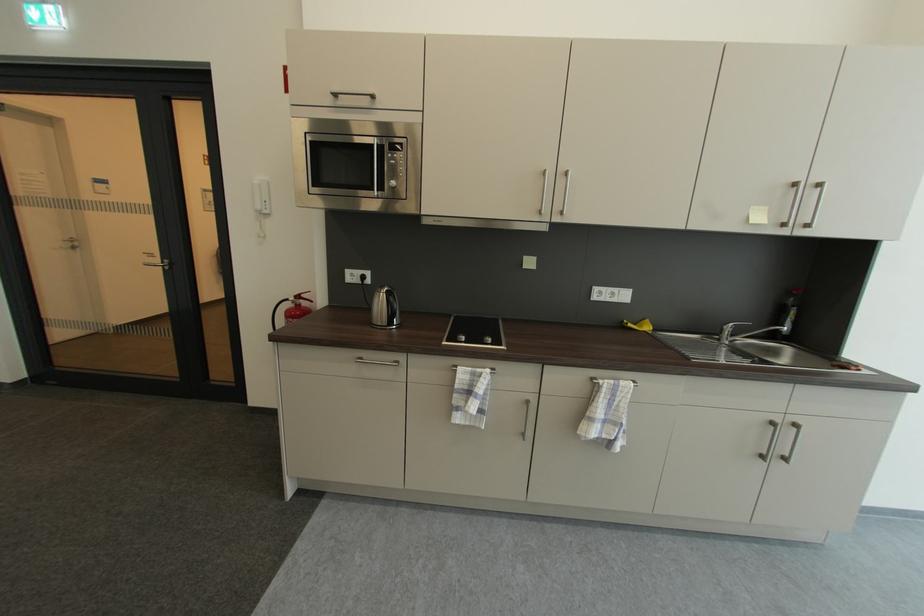
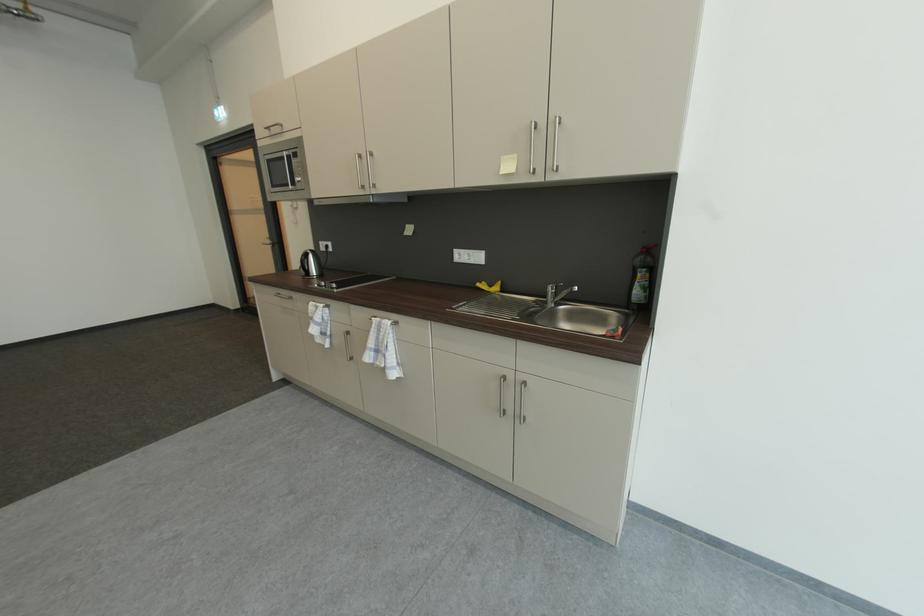
Find the pixel in the second image that matches (801,294) in the first image.

(650, 252)